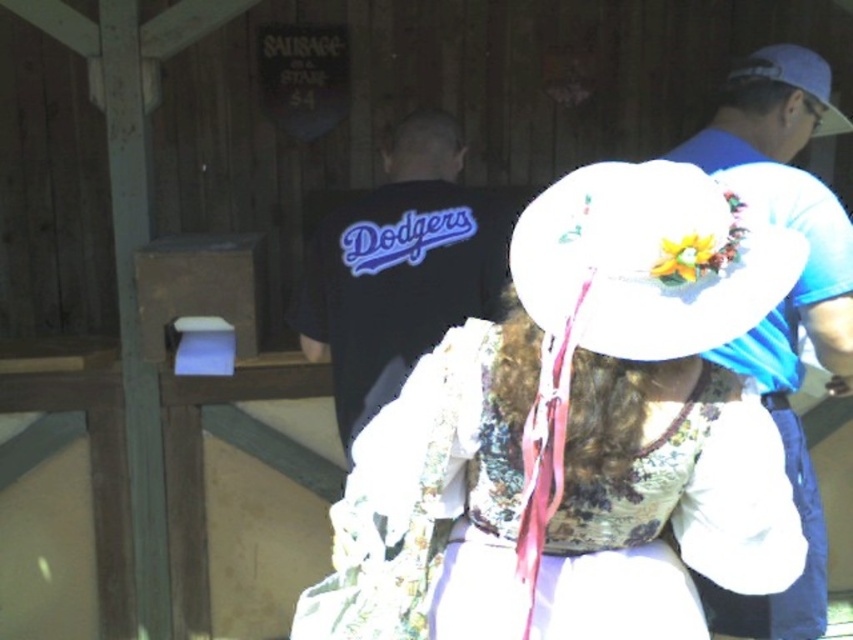
In the fairground scene, there are three people. The first person is wearing a large white hat with a yellow flower and red ribbon, seated in the foreground. The second person is partially obscured, wearing a blue shirt and baseball cap, standing behind them. The third person is in the background wearing a black shirt with Dodgers on the back. There is a point at coordinates (648, 260). Which object is located at this point?

The white fabric cowboy hat at center is located at point (648, 260).

You are at a fair and want to take a photo of both the white fabric hat at center and the black fabric dodgers shirt at center. Which object should you position closer to the left side of your camera frame to include both in the photo?

The white fabric hat at center is to the right of black fabric dodgers shirt at center, so you should position the black fabric dodgers shirt at center closer to the left side of your camera frame to include both in the photo.